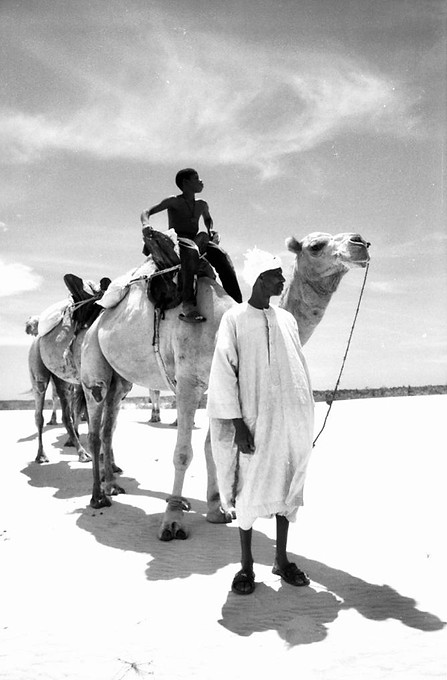
Identify the location of sheet. Image resolution: width=447 pixels, height=680 pixels. click(167, 256).